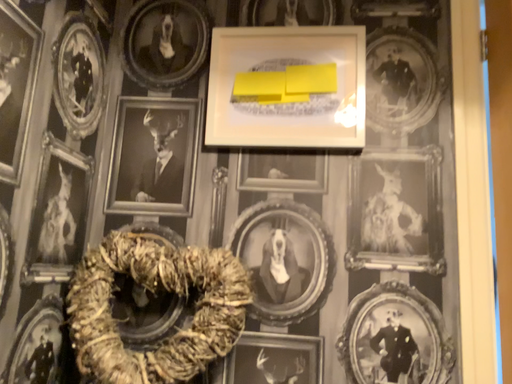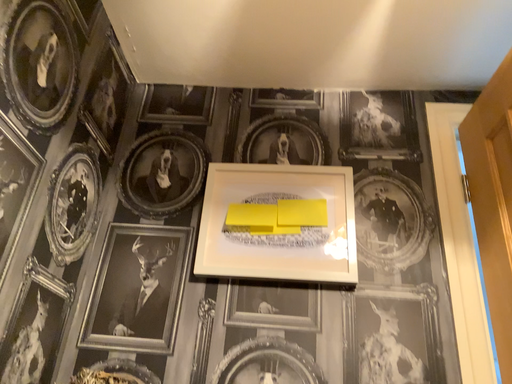
Question: Which way did the camera rotate in the video?

Choices:
 (A) rotated downward
 (B) rotated upward

Answer: (B)